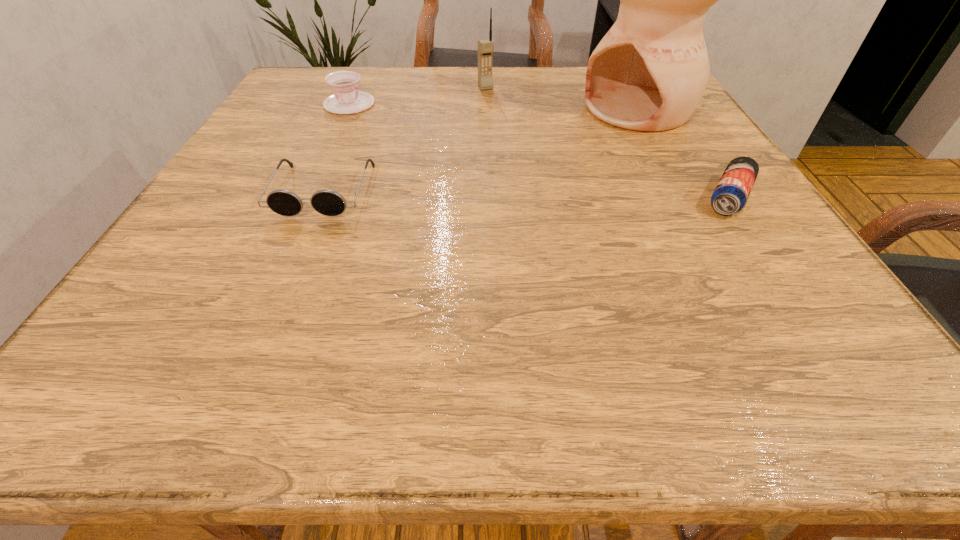
I want to click on sunglasses, so click(327, 202).

Find the location of `beer can`. beer can is located at coordinates (731, 193).

Identify the location of pottery. The image size is (960, 540). (649, 72).

At what (x,y) coordinates should I click in order to perform the action: click on teacup. Please return your answer as a coordinate pair (x, y). The image size is (960, 540). Looking at the image, I should click on (346, 99).

Find the location of a particular element. The width and height of the screenshot is (960, 540). cellular telephone is located at coordinates (485, 47).

I want to click on the third object from left to right, so click(485, 47).

At what (x,y) coordinates should I click in order to perform the action: click on vacant space located on the front-facing side of the sunglasses. Please return your answer as a coordinate pair (x, y). Looking at the image, I should click on (268, 322).

You are a GUI agent. You are given a task and a screenshot of the screen. Output one action in this format:
    pyautogui.click(x=<x>, y=<y>)
    Task: Click on the vacant area situated 0.330m on the back of the beer can
    The image size is (960, 540).
    Given the screenshot: What is the action you would take?
    pyautogui.click(x=665, y=100)

The width and height of the screenshot is (960, 540). In order to click on vacant space positioned 0.150m at the open side of the pottery in this screenshot , I will do `click(557, 150)`.

At what (x,y) coordinates should I click in order to perform the action: click on vacant space positioned 0.300m at the open side of the pottery. Please return your answer as a coordinate pair (x, y). The width and height of the screenshot is (960, 540). Looking at the image, I should click on (503, 176).